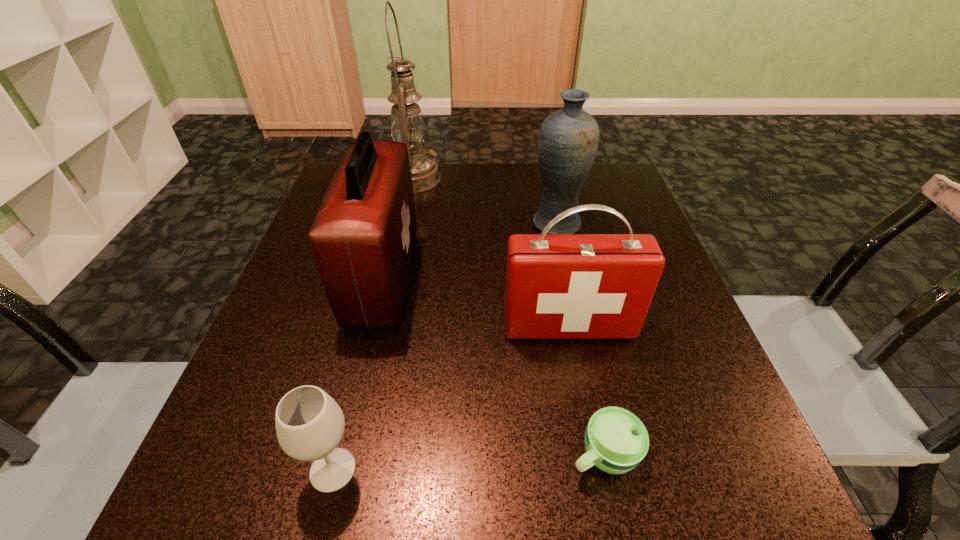
Where is `blank space that satisfies the following two spatial constraints: 1. on the front face of the right first-aid kit; 2. on the right side of the cup`? The image size is (960, 540). blank space that satisfies the following two spatial constraints: 1. on the front face of the right first-aid kit; 2. on the right side of the cup is located at coordinates (593, 455).